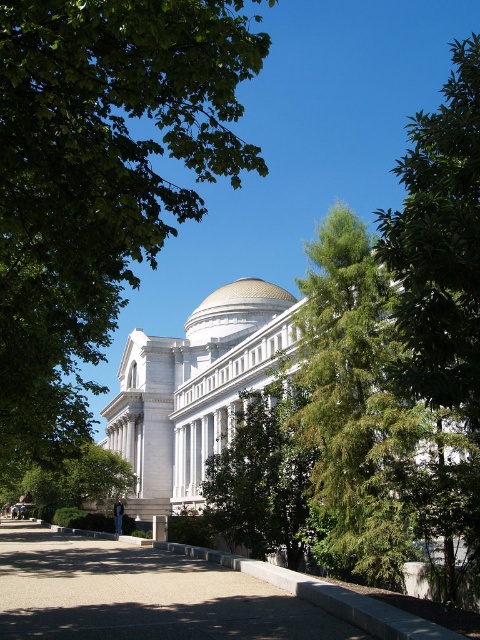
Between green leafy tree at upper left and gold metallic dome at center, which one has more height?

Standing taller between the two is green leafy tree at upper left.

Consider the image. Between green leafy tree at upper left and gold metallic dome at center, which one has less height?

Standing shorter between the two is gold metallic dome at center.

Is point (119, 220) closer to camera compared to point (211, 296)?

Yes, point (119, 220) is in front of point (211, 296).

Where is `green leafy tree at upper left`? This screenshot has width=480, height=640. green leafy tree at upper left is located at coordinates (98, 182).

Does green textured tree at center have a smaller size compared to green leafy tree at upper right?

Yes, green textured tree at center is smaller than green leafy tree at upper right.

Looking at this image, is green textured tree at center thinner than green leafy tree at upper right?

Yes.

Who is more forward, (x=331, y=515) or (x=447, y=397)?

Positioned in front is point (x=447, y=397).

The height and width of the screenshot is (640, 480). I want to click on green textured tree at center, so click(350, 406).

Can you confirm if green leafy tree at upper right is wider than gold metallic dome at center?

Correct, the width of green leafy tree at upper right exceeds that of gold metallic dome at center.

Is point (454, 364) farther from camera compared to point (192, 316)?

No, it is in front of (192, 316).

I want to click on green leafy tree at upper right, so click(x=440, y=244).